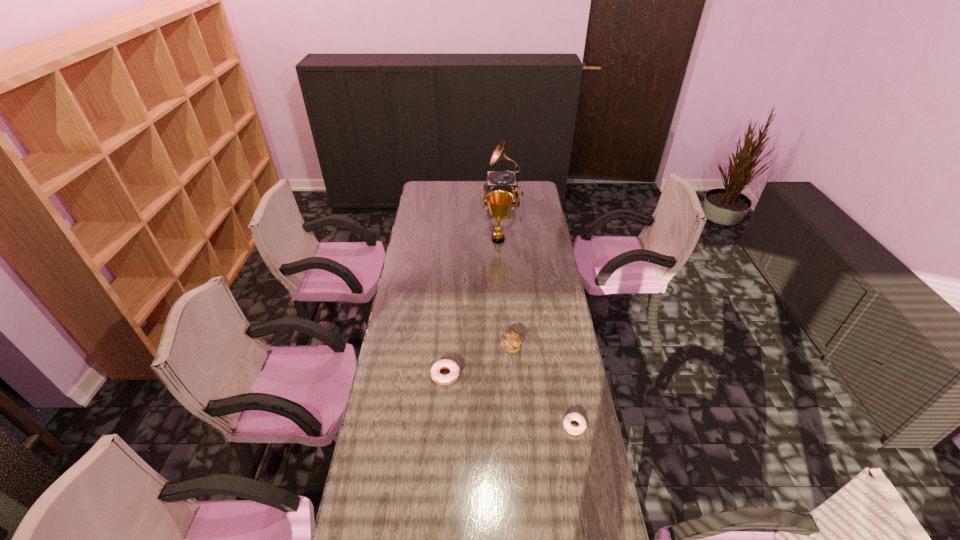
Image resolution: width=960 pixels, height=540 pixels. What are the coordinates of `record player` in the screenshot? It's located at (506, 180).

Identify the location of award. The image size is (960, 540). (499, 201).

Locate an element on the screen. muffin is located at coordinates (511, 341).

You are a GUI agent. You are given a task and a screenshot of the screen. Output one action in this format:
    pyautogui.click(x=<x>, y=<y>)
    Task: Click on the third shortest object
    
    Given the screenshot: What is the action you would take?
    pyautogui.click(x=511, y=341)

Identify the location of the left doughnut. (444, 380).

Image resolution: width=960 pixels, height=540 pixels. What are the coordinates of `the second shortest object` in the screenshot? It's located at [444, 380].

This screenshot has width=960, height=540. I want to click on the shorter doughnut, so click(x=575, y=416).

At what (x,y) coordinates should I click in order to perform the action: click on the rightmost object. Please return your answer as a coordinate pair (x, y). This screenshot has width=960, height=540. Looking at the image, I should click on (575, 416).

Where is `free space located on the horn of the record player`? This screenshot has height=540, width=960. free space located on the horn of the record player is located at coordinates (472, 197).

Image resolution: width=960 pixels, height=540 pixels. Find the location of `vacant space located on the horn of the record player`. vacant space located on the horn of the record player is located at coordinates (425, 197).